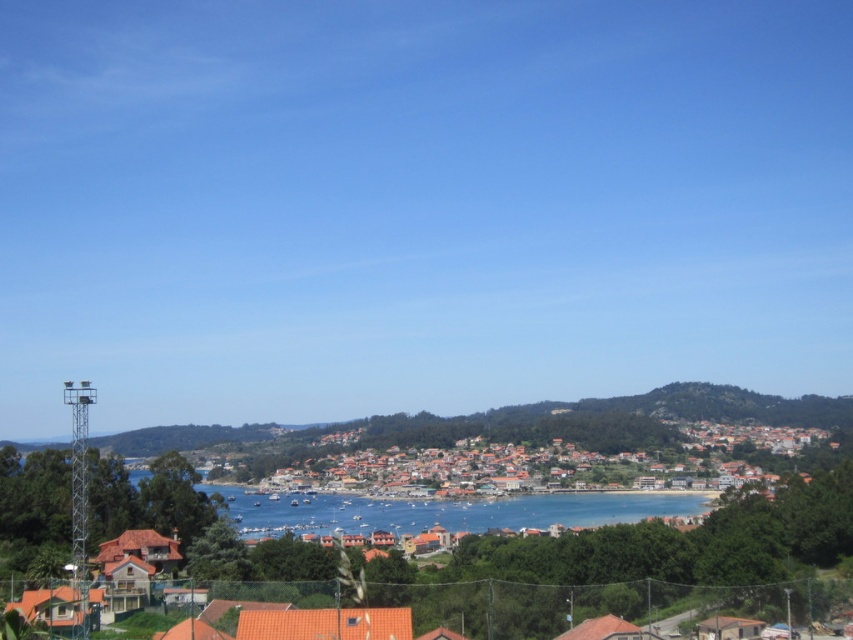
Question: Is orange tiled roofs at center closer to the viewer compared to blue water at center?

Choices:
 (A) no
 (B) yes

Answer: (A)

Question: Which of the following is the farthest from the observer?

Choices:
 (A) (546, 472)
 (B) (480, 528)

Answer: (A)

Question: Among these points, which one is nearest to the camera?

Choices:
 (A) (656, 492)
 (B) (448, 490)

Answer: (B)

Question: Is orange tiled roofs at center thinner than blue water at center?

Choices:
 (A) no
 (B) yes

Answer: (A)

Question: Which point is closer to the camera?

Choices:
 (A) (505, 483)
 (B) (367, 515)

Answer: (B)

Question: Does orange tiled roofs at center appear on the right side of blue water at center?

Choices:
 (A) yes
 (B) no

Answer: (A)